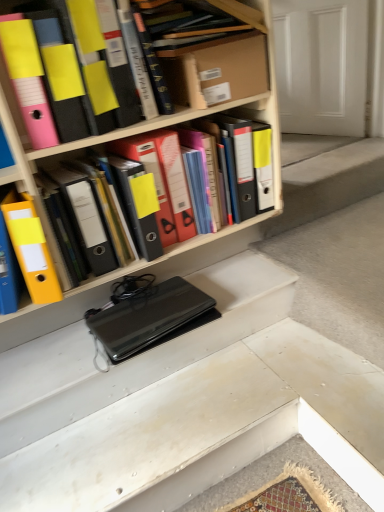
I want to click on free spot to the right of black matte laptop at center, so click(233, 285).